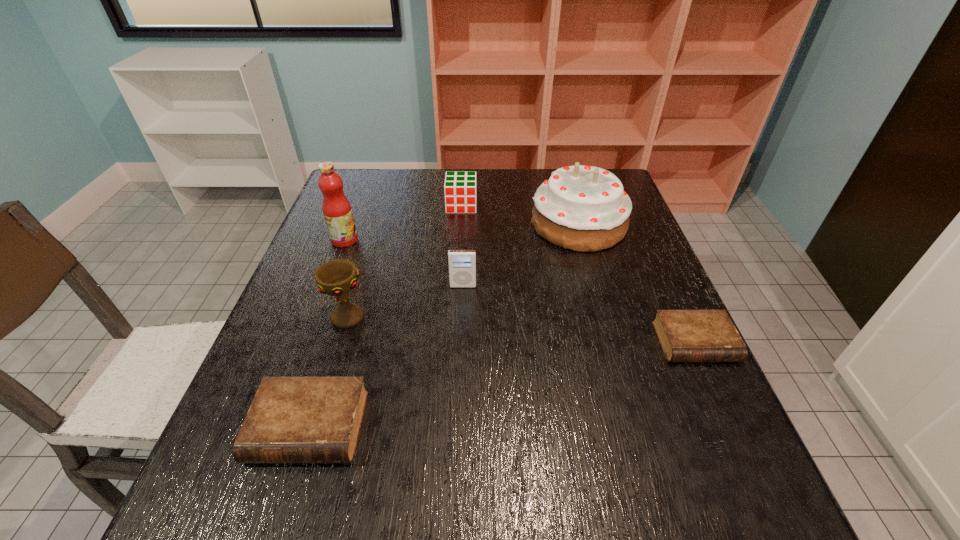
The width and height of the screenshot is (960, 540). I want to click on spot to insert another diary for uniform distribution, so click(x=518, y=381).